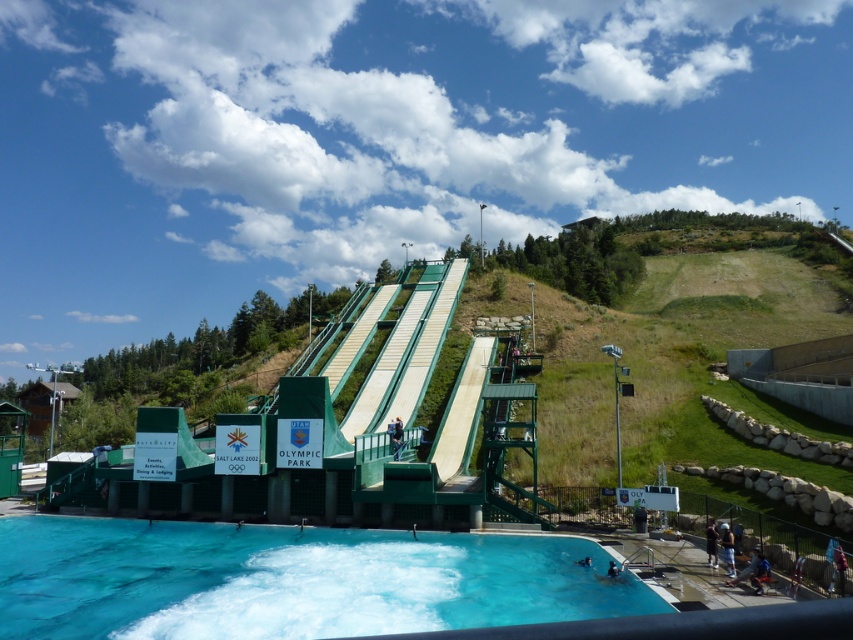
Does point (148, 634) come in front of point (728, 572)?

Yes.

Who is more distant from viewer, (172, 556) or (734, 566)?

The point (172, 556) is behind.

Is point (549, 604) closer to viewer compared to point (730, 561)?

Yes.

You are a GUI agent. You are given a task and a screenshot of the screen. Output one action in this format:
    pyautogui.click(x=<x>, y=<y>)
    Task: Click on the clear blue water at lower left
    The height and width of the screenshot is (640, 853).
    Given the screenshot: What is the action you would take?
    pyautogui.click(x=289, y=580)

Is point (730, 554) positioned in front of point (622, 568)?

Yes.

Who is positioned more to the left, light blue denim shorts at lower right or dark blue wetsuit at lower center?

From the viewer's perspective, dark blue wetsuit at lower center appears more on the left side.

The height and width of the screenshot is (640, 853). Find the location of `light blue denim shorts at lower right`. light blue denim shorts at lower right is located at coordinates (728, 548).

Is point (196, 628) positioned after point (392, 429)?

No, it is not.

Between point (328, 634) and point (399, 422), which one is positioned behind?

The point (399, 422) is more distant.

The image size is (853, 640). I want to click on clear blue water at lower left, so click(289, 580).